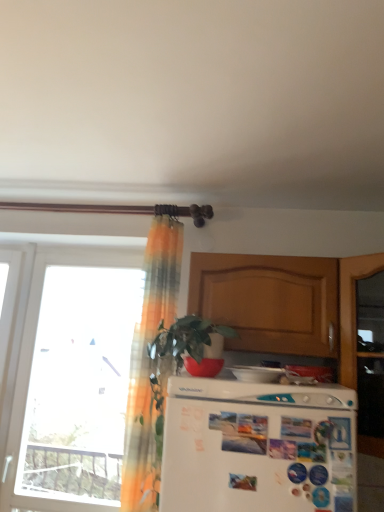
This screenshot has width=384, height=512. Describe the element at coordinates (149, 362) in the screenshot. I see `translucent orange curtain at upper left` at that location.

This screenshot has height=512, width=384. What do you see at coordinates (68, 372) in the screenshot? I see `transparent glass window at left` at bounding box center [68, 372].

In order to face white matte refrigerator at center, should I rotate leftwards or rightwards?

Rotate right and turn 8.074 degrees.

Find the location of a particular element. This screenshot has height=512, width=384. white glossy refrigerator at lower center, which is counted as the second appliance, starting from the front is located at coordinates (312, 372).

At what (x,y) coordinates should I click in order to perform the action: click on wooden cabinet at upper center. Please return your answer as a coordinate pair (x, y). Looking at the image, I should click on (269, 301).

Consider the image. From the image's perspective, which is above, white glossy refrigerator at lower center, which appears as the first appliance when viewed from the back, or white glossy refrigerator at center, arranged as the 2th appliance when viewed from the back?

white glossy refrigerator at center, arranged as the 2th appliance when viewed from the back.

Find the location of a particular element. This screenshot has height=512, width=384. appliance on the left of white glossy refrigerator at lower center, the 2th appliance when ordered from left to right is located at coordinates (257, 374).

Which is less distant, [312,369] or [269,374]?

Clearly, point [312,369] is more distant from the camera than point [269,374].

In the image, is white glossy refrigerator at lower center, the 2th appliance when ordered from left to right, positioned in front of or behind white glossy refrigerator at center, the first appliance from the front?

In the image, white glossy refrigerator at lower center, the 2th appliance when ordered from left to right, appears behind white glossy refrigerator at center, the first appliance from the front.

Does white glossy refrigerator at lower center, which appears as the first appliance when viewed from the back, have a smaller size compared to wooden cabinet at upper center?

Indeed, white glossy refrigerator at lower center, which appears as the first appliance when viewed from the back, has a smaller size compared to wooden cabinet at upper center.

Is white glossy refrigerator at lower center, which appears as the first appliance when viewed from the back, surrounding wooden cabinet at upper center?

No, wooden cabinet at upper center is not inside white glossy refrigerator at lower center, which appears as the first appliance when viewed from the back.

From a real-world perspective, which is physically above, white glossy refrigerator at lower center, which appears as the first appliance when viewed from the back, or wooden cabinet at upper center?

wooden cabinet at upper center, from a real-world perspective.

Which object is more forward, transparent glass window at left or white matte refrigerator at center?

white matte refrigerator at center is more forward.

From the image's perspective, between transparent glass window at left and white matte refrigerator at center, who is located below?

From the image's view, white matte refrigerator at center is below.

Between transparent glass window at left and white matte refrigerator at center, which one has more height?

transparent glass window at left.

Does wooden cabinet at upper center have a lesser width compared to white glossy refrigerator at center, positioned as the second appliance in right-to-left order?

No, wooden cabinet at upper center is not thinner than white glossy refrigerator at center, positioned as the second appliance in right-to-left order.

From the image's perspective, would you say wooden cabinet at upper center is positioned over white glossy refrigerator at center, arranged as the 2th appliance when viewed from the back?

Yes, from the image's perspective, wooden cabinet at upper center is on top of white glossy refrigerator at center, arranged as the 2th appliance when viewed from the back.

From a real-world perspective, between wooden cabinet at upper center and white glossy refrigerator at center, arranged as the 2th appliance when viewed from the back, who is vertically higher?

wooden cabinet at upper center is physically above.

Is transparent glass window at left at the left side of white glossy refrigerator at center, the first appliance from the front?

Correct, you'll find transparent glass window at left to the left of white glossy refrigerator at center, the first appliance from the front.

Is transparent glass window at left in front of white glossy refrigerator at center, the first appliance from the front?

No, transparent glass window at left is further to the viewer.

Can you confirm if transparent glass window at left is bigger than white glossy refrigerator at center, positioned as the second appliance in right-to-left order?

Correct, transparent glass window at left is larger in size than white glossy refrigerator at center, positioned as the second appliance in right-to-left order.

How far apart are transparent glass window at left and white glossy refrigerator at center, positioned as the second appliance in right-to-left order?

The distance of transparent glass window at left from white glossy refrigerator at center, positioned as the second appliance in right-to-left order, is 4.10 feet.

Does white glossy refrigerator at center, positioned as the second appliance in right-to-left order, have a greater height compared to transparent glass window at left?

In fact, white glossy refrigerator at center, positioned as the second appliance in right-to-left order, may be shorter than transparent glass window at left.

Can you confirm if white glossy refrigerator at center, positioned as the second appliance in right-to-left order, is smaller than transparent glass window at left?

Yes, white glossy refrigerator at center, positioned as the second appliance in right-to-left order, is smaller than transparent glass window at left.

Would you consider white glossy refrigerator at center, the first appliance from the front, to be distant from transparent glass window at left?

white glossy refrigerator at center, the first appliance from the front, is far away from transparent glass window at left.

From a real-world perspective, who is located lower, white matte refrigerator at center or transparent glass window at left?

white matte refrigerator at center, from a real-world perspective.

In the scene shown: How different are the orientations of white matte refrigerator at center and transparent glass window at left in degrees?

They differ by 0.0492 degrees in their facing directions.

Is white matte refrigerator at center wider than transparent glass window at left?

Yes, white matte refrigerator at center is wider than transparent glass window at left.

Between white matte refrigerator at center and transparent glass window at left, which one appears on the left side from the viewer's perspective?

From the viewer's perspective, transparent glass window at left appears more on the left side.

In the image, there is a white glossy refrigerator at center, arranged as the 2th appliance when viewed from the back. At what (x,y) coordinates should I click in order to perform the action: click on appliance below it (from the image's perspective). Please return your answer as a coordinate pair (x, y). Image resolution: width=384 pixels, height=512 pixels. Looking at the image, I should click on (312, 372).

What are the coordinates of `cabinetry located above the white glossy refrigerator at lower center, which appears as the first appliance when viewed from the back (from the image's perspective)` in the screenshot? It's located at (269, 301).

Looking at the image, which one is located further to white glossy refrigerator at center, which is the 1th appliance in left-to-right order, white matte refrigerator at center or transparent glass window at left?

transparent glass window at left is further to white glossy refrigerator at center, which is the 1th appliance in left-to-right order.

When comparing their distances from translucent orange curtain at upper left, does wooden cabinet at upper center or white glossy refrigerator at lower center, which appears as the first appliance when viewed from the back, seem further?

Among the two, white glossy refrigerator at lower center, which appears as the first appliance when viewed from the back, is located further to translucent orange curtain at upper left.

From the image, which object appears to be nearer to white glossy refrigerator at center, which is the 1th appliance in left-to-right order, wooden cabinet at upper center or white matte refrigerator at center?

white matte refrigerator at center is positioned closer to the anchor white glossy refrigerator at center, which is the 1th appliance in left-to-right order.

Considering their positions, is translucent orange curtain at upper left positioned closer to white glossy refrigerator at lower center, which appears as the first appliance when viewed from the back, than wooden cabinet at upper center?

wooden cabinet at upper center is positioned closer to the anchor white glossy refrigerator at lower center, which appears as the first appliance when viewed from the back.

When comparing their distances from wooden cabinet at upper center, does white matte refrigerator at center or white glossy refrigerator at center, which is the 1th appliance in left-to-right order, seem further?

white matte refrigerator at center lies further to wooden cabinet at upper center than the other object.

When comparing their distances from translucent orange curtain at upper left, does white matte refrigerator at center or transparent glass window at left seem further?

transparent glass window at left.

When comparing their distances from white glossy refrigerator at lower center, which is counted as the second appliance, starting from the front, does white matte refrigerator at center or translucent orange curtain at upper left seem closer?

white matte refrigerator at center lies closer to white glossy refrigerator at lower center, which is counted as the second appliance, starting from the front, than the other object.

Estimate the real-world distances between objects in this image. Which object is further from white glossy refrigerator at center, the first appliance from the front, wooden cabinet at upper center or transparent glass window at left?

transparent glass window at left is positioned further to the anchor white glossy refrigerator at center, the first appliance from the front.

This screenshot has width=384, height=512. In order to click on refrigerator between translucent orange curtain at upper left and white glossy refrigerator at lower center, the 2th appliance when ordered from left to right, in the horizontal direction in this screenshot , I will do `click(258, 447)`.

This screenshot has width=384, height=512. What are the coordinates of `curtain situated between transparent glass window at left and wooden cabinet at upper center from left to right` in the screenshot? It's located at (149, 362).

The image size is (384, 512). Find the location of `appliance between translucent orange curtain at upper left and white glossy refrigerator at lower center, placed as the first appliance when sorted from right to left, from left to right`. appliance between translucent orange curtain at upper left and white glossy refrigerator at lower center, placed as the first appliance when sorted from right to left, from left to right is located at coordinates (257, 374).

Locate an element on the screen. This screenshot has width=384, height=512. refrigerator between transparent glass window at left and wooden cabinet at upper center in the horizontal direction is located at coordinates (258, 447).